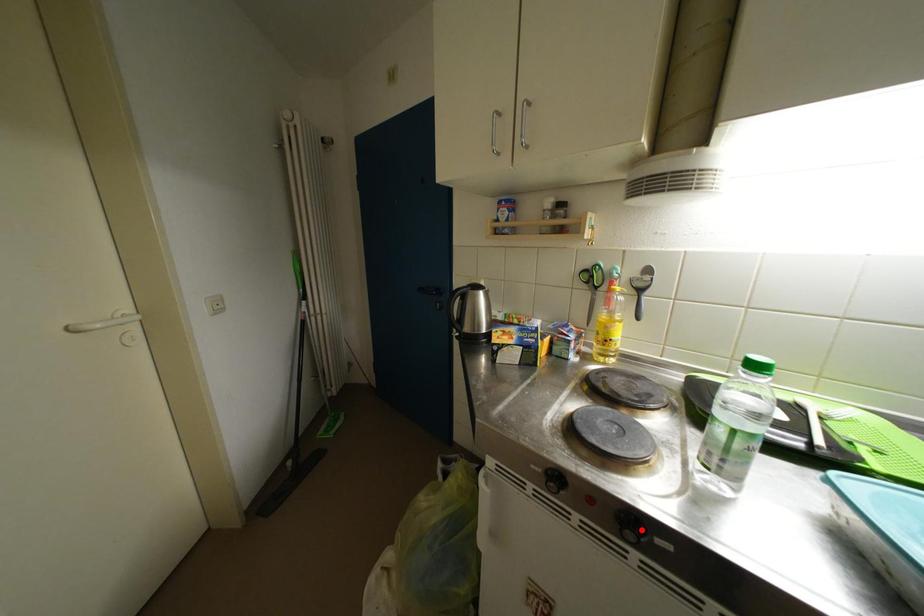
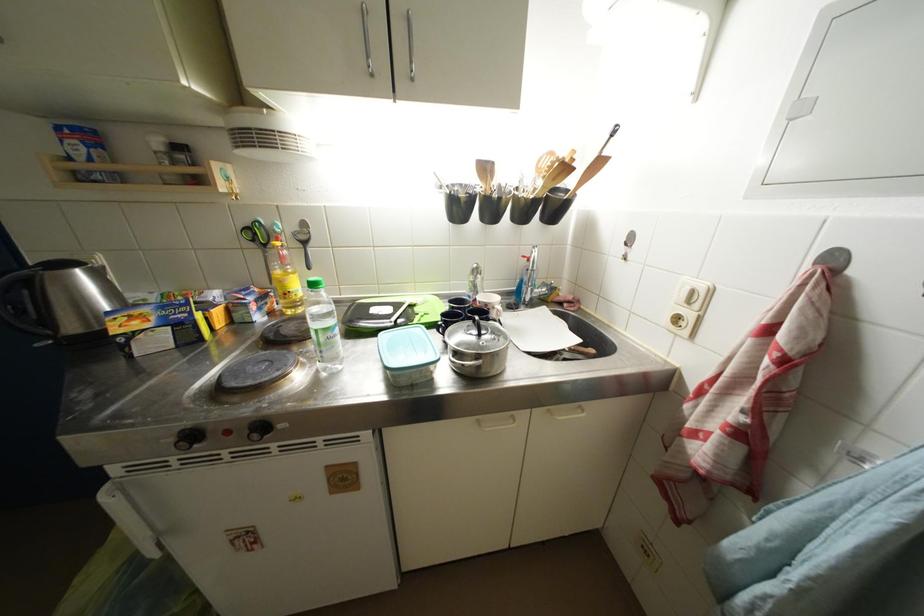
Locate, in the second image, the point that corresponds to the highlighted location in the first image.

(269, 431)